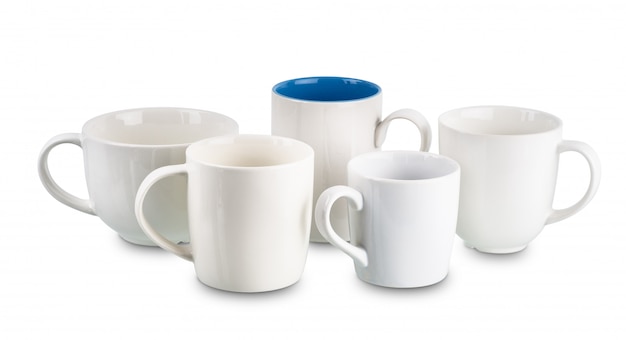
You are a GUI agent. You are given a task and a screenshot of the screen. Output one action in this format:
    pyautogui.click(x=<x>, y=<y>)
    Task: Click on the interior of mug
    
    Given the screenshot: What is the action you would take?
    pyautogui.click(x=150, y=125), pyautogui.click(x=252, y=155), pyautogui.click(x=387, y=170), pyautogui.click(x=495, y=122), pyautogui.click(x=327, y=90)